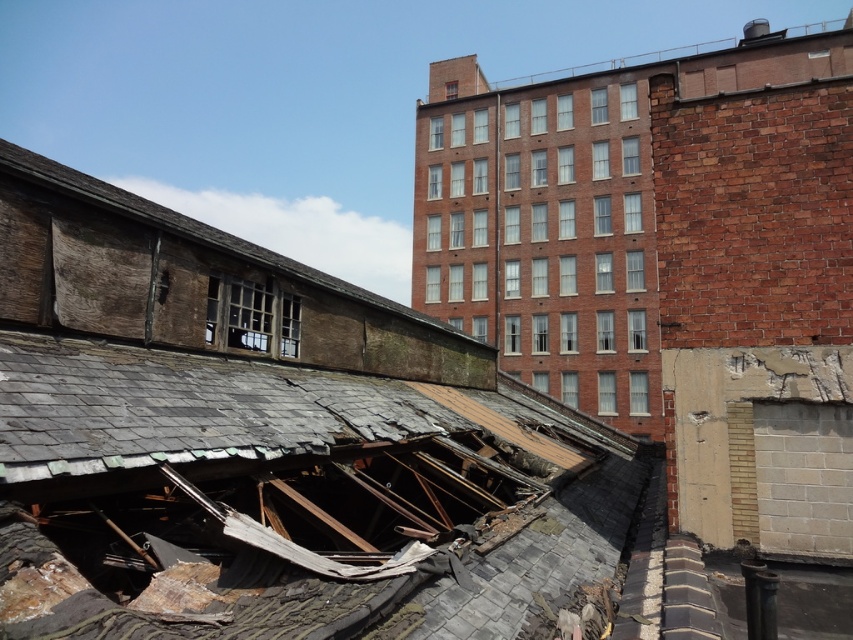
Question: From the image, what is the correct spatial relationship of weathered wood at upper left in relation to smooth brick roof at upper center?

Choices:
 (A) left
 (B) right

Answer: (A)

Question: Can you confirm if weathered wood at upper left is positioned to the left of smooth brick roof at upper center?

Choices:
 (A) no
 (B) yes

Answer: (B)

Question: Is weathered wood at upper left closer to camera compared to smooth brick roof at upper center?

Choices:
 (A) yes
 (B) no

Answer: (A)

Question: Among these objects, which one is nearest to the camera?

Choices:
 (A) smooth brick roof at upper center
 (B) weathered wood at upper left

Answer: (B)

Question: Which point appears farthest from the camera in this image?

Choices:
 (A) (540, 81)
 (B) (206, 240)

Answer: (A)

Question: Among these points, which one is nearest to the camera?

Choices:
 (A) (453, 81)
 (B) (259, 256)

Answer: (B)